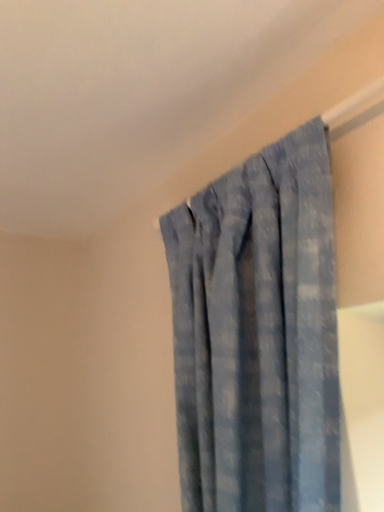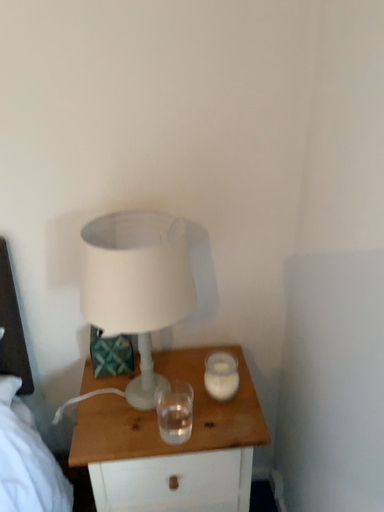
Question: How did the camera likely rotate when shooting the video?

Choices:
 (A) rotated right
 (B) rotated left

Answer: (B)